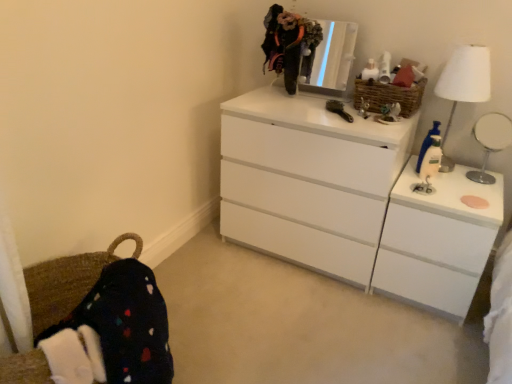
You are a GUI agent. You are given a task and a screenshot of the screen. Output one action in this format:
    pyautogui.click(x=<x>, y=<y>)
    Task: Click on the blank space situated above woven brown basket at upper right (from a real-world perspective)
    The image size is (512, 384).
    Given the screenshot: What is the action you would take?
    pyautogui.click(x=389, y=84)